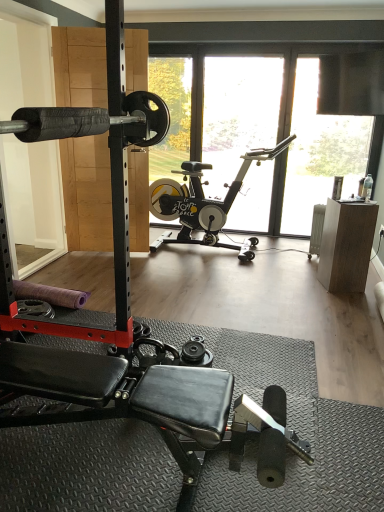
This screenshot has width=384, height=512. Describe the element at coordinates (33, 203) in the screenshot. I see `black rubber barbell at left` at that location.

The image size is (384, 512). What do you see at coordinates (196, 352) in the screenshot?
I see `black rubber dumbbell at center` at bounding box center [196, 352].

Find the location of a particular element. This screenshot has height=512, width=384. black rubber stationary bicycle at center is located at coordinates (204, 203).

The height and width of the screenshot is (512, 384). Identify the location of black rubber barbell at left. (33, 203).

Is black rubber dumbbell at center wider than transparent glass window at upper center?

Yes, black rubber dumbbell at center is wider than transparent glass window at upper center.

You are a GUI agent. You are given a task and a screenshot of the screen. Output one action in this format:
    pyautogui.click(x=<x>, y=<y>)
    Task: Click on the window screen on the right of black rubber dumbbell at center
    The height and width of the screenshot is (512, 384).
    Given the screenshot: What is the action you would take?
    pyautogui.click(x=320, y=152)

Considering the sizes of objects black rubber dumbbell at center and transparent glass window at upper center in the image provided, who is shorter, black rubber dumbbell at center or transparent glass window at upper center?

black rubber dumbbell at center is shorter.

Based on the photo, is black rubber barbell at left bigger or smaller than transparent glass window at upper center?

black rubber barbell at left is bigger than transparent glass window at upper center.

From their relative heights in the image, would you say black rubber barbell at left is taller or shorter than transparent glass window at upper center?

In the image, black rubber barbell at left appears to be taller than transparent glass window at upper center.

Do you think black rubber barbell at left is within transparent glass window at upper center, or outside of it?

black rubber barbell at left is outside transparent glass window at upper center.

Looking at their sizes, would you say black rubber barbell at left is wider or thinner than transparent glass window at upper center?

black rubber barbell at left is wider than transparent glass window at upper center.

Is black rubber stationary bicycle at center positioned with its back to black rubber barbell at left?

That's not correct — black rubber stationary bicycle at center is not looking away from black rubber barbell at left.

Is black rubber stationary bicycle at center shorter than black rubber barbell at left?

Correct, black rubber stationary bicycle at center is not as tall as black rubber barbell at left.

Which object is further away from the camera, black rubber stationary bicycle at center or black rubber barbell at left?

Positioned behind is black rubber stationary bicycle at center.

Locate an element on the screen. This screenshot has width=384, height=512. screen door in front of the black rubber stationary bicycle at center is located at coordinates (33, 203).

Is black rubber stationary bicycle at center facing away from transparent glass window at upper center?

Correct, black rubber stationary bicycle at center is looking away from transparent glass window at upper center.

Consider the image. Is black rubber stationary bicycle at center wider than transparent glass window at upper center?

Indeed, black rubber stationary bicycle at center has a greater width compared to transparent glass window at upper center.

Considering the relative positions of black rubber stationary bicycle at center and transparent glass window at upper center in the image provided, is black rubber stationary bicycle at center in front of transparent glass window at upper center?

Yes, the depth of black rubber stationary bicycle at center is less than that of transparent glass window at upper center.

Which of these two, black rubber stationary bicycle at center or transparent glass window at upper center, is smaller?

With smaller size is transparent glass window at upper center.

From a real-world perspective, does transparent glass window at upper center sit lower than black rubber stationary bicycle at center?

No.

How far apart are transparent glass window at upper center and black rubber stationary bicycle at center?

transparent glass window at upper center and black rubber stationary bicycle at center are 82.16 centimeters apart from each other.

Looking at the image, does transparent glass window at upper center seem bigger or smaller compared to black rubber stationary bicycle at center?

transparent glass window at upper center is smaller than black rubber stationary bicycle at center.

Which is less distant, (322,165) or (207,229)?

Point (322,165).

How many degrees apart are the facing directions of black rubber dumbbell at center and black rubber barbell at left?

The facing directions of black rubber dumbbell at center and black rubber barbell at left are 29.6 degrees apart.

Does black rubber dumbbell at center touch black rubber barbell at left?

They are not placed beside each other.

Looking at this image, from a real-world perspective, does black rubber dumbbell at center sit lower than black rubber barbell at left?

Yes, from a real-world perspective, black rubber dumbbell at center is beneath black rubber barbell at left.

Is transparent glass window at upper center spatially inside black rubber dumbbell at center, or outside of it?

transparent glass window at upper center is spatially situated outside black rubber dumbbell at center.

Find the location of a particular element. window screen positioned vertically above the black rubber dumbbell at center (from a real-world perspective) is located at coordinates (320, 152).

From a real-world perspective, is transparent glass window at upper center positioned over black rubber dumbbell at center based on gravity?

Yes, from a real-world perspective, transparent glass window at upper center is on top of black rubber dumbbell at center.

Can you confirm if transparent glass window at upper center is wider than black rubber dumbbell at center?

No, transparent glass window at upper center is not wider than black rubber dumbbell at center.

The image size is (384, 512). In order to click on window screen above the black rubber dumbbell at center (from a real-world perspective) in this screenshot , I will do `click(320, 152)`.

Identify the location of screen door on the left of transparent glass window at upper center. (33, 203).

From the picture: Estimate the real-world distances between objects in this image. Which object is closer to transparent glass window at upper center, black rubber stationary bicycle at center or black rubber barbell at left?

black rubber stationary bicycle at center lies closer to transparent glass window at upper center than the other object.

Estimate the real-world distances between objects in this image. Which object is further from black rubber dumbbell at center, black rubber barbell at left or black rubber stationary bicycle at center?

Based on the image, black rubber barbell at left appears to be further to black rubber dumbbell at center.

Looking at the image, which one is located closer to transparent glass window at upper center, black rubber stationary bicycle at center or black rubber dumbbell at center?

black rubber stationary bicycle at center is closer to transparent glass window at upper center.

Estimate the real-world distances between objects in this image. Which object is closer to transparent glass window at upper center, black rubber dumbbell at center or black rubber stationary bicycle at center?

The object closer to transparent glass window at upper center is black rubber stationary bicycle at center.

Based on the photo, looking at the image, which one is located closer to black rubber stationary bicycle at center, black rubber barbell at left or black rubber dumbbell at center?

black rubber barbell at left.

When comparing their distances from black rubber barbell at left, does transparent glass window at upper center or black rubber dumbbell at center seem further?

transparent glass window at upper center.

Considering their positions, is black rubber barbell at left positioned further to transparent glass window at upper center than black rubber dumbbell at center?

black rubber dumbbell at center is positioned further to the anchor transparent glass window at upper center.

Based on their spatial positions, is black rubber stationary bicycle at center or black rubber dumbbell at center further from black rubber barbell at left?

The object further to black rubber barbell at left is black rubber dumbbell at center.

This screenshot has height=512, width=384. I want to click on stationary bicycle located between black rubber barbell at left and transparent glass window at upper center in the left-right direction, so click(x=204, y=203).

Locate an element on the screen. Image resolution: width=384 pixels, height=512 pixels. dumbbell between black rubber barbell at left and black rubber stationary bicycle at center in the horizontal direction is located at coordinates (196, 352).

I want to click on stationary bicycle between black rubber dumbbell at center and transparent glass window at upper center from front to back, so click(x=204, y=203).

This screenshot has width=384, height=512. I want to click on dumbbell between black rubber barbell at left and transparent glass window at upper center, so click(196, 352).